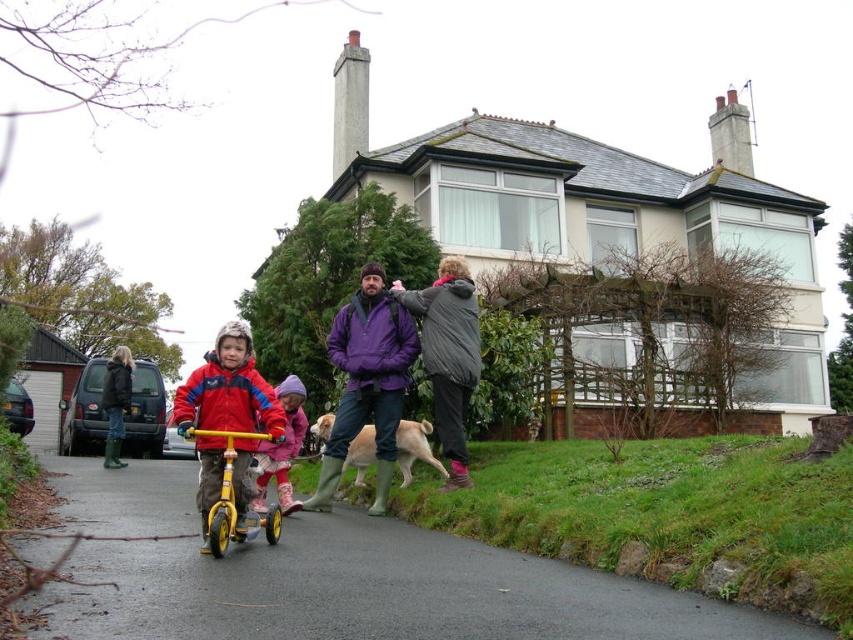
Who is higher up, smooth asphalt path at center or purple matte jacket at center?

smooth asphalt path at center is higher up.

Which is in front, point (639, 627) or point (364, 308)?

Point (639, 627) is in front.

At what (x,y) coordinates should I click in order to perform the action: click on smooth asphalt path at center. Please return your answer as a coordinate pair (x, y). The width and height of the screenshot is (853, 640). Looking at the image, I should click on (375, 593).

Between purple matte jacket at center and matte pink snowsuit at center, which one has more height?

purple matte jacket at center is taller.

Looking at this image, does purple matte jacket at center appear on the right side of matte pink snowsuit at center?

Yes, purple matte jacket at center is to the right of matte pink snowsuit at center.

Is point (345, 317) behind point (281, 513)?

That is True.

Locate an element on the screen. The width and height of the screenshot is (853, 640). purple matte jacket at center is located at coordinates (367, 381).

Who is more distant from viewer, (526, 556) or (281, 492)?

Positioned behind is point (281, 492).

The width and height of the screenshot is (853, 640). I want to click on smooth asphalt path at center, so click(x=375, y=593).